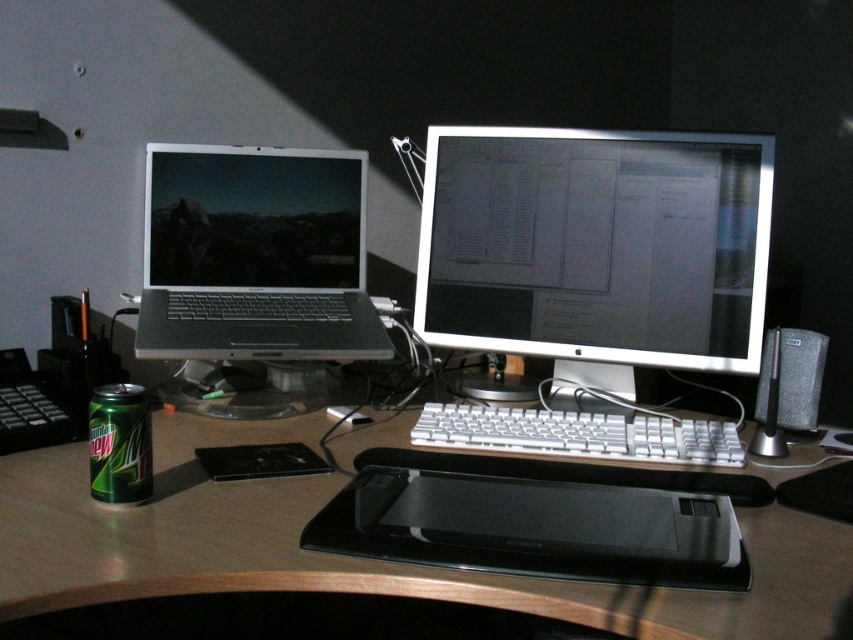
You need to place a new ruler that is 12 inches long on the desk. Given the black plastic drawing tablet at center and the black matte speaker at right, which object can the ruler fit entirely on top of without hanging off?

The black plastic drawing tablet at center has a larger width than the black matte speaker at right, so the ruler can fit entirely on the black plastic drawing tablet at center.

You are sitting at the desk and want to reach both points on the desk. Which point, point 1 at coordinates (x=374, y=506) or point 2 at coordinates (x=802, y=369), is closer to you?

Point 1 at coordinates (x=374, y=506) is closer to you because it is in front of point 2 at coordinates (x=802, y=369).